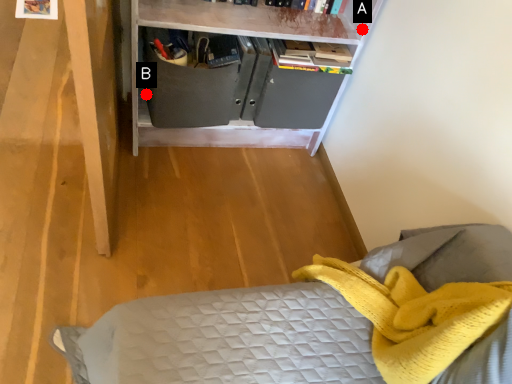
Question: Two points are circled on the image, labeled by A and B beside each circle. Which point is closer to the camera?

Choices:
 (A) A is closer
 (B) B is closer

Answer: (A)